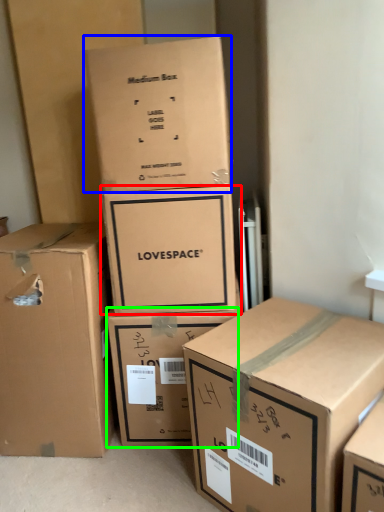
Question: Estimate the real-world distances between objects in this image. Which object is farther from box (highlighted by a red box), box (highlighted by a blue box) or box (highlighted by a green box)?

Choices:
 (A) box
 (B) box

Answer: (B)